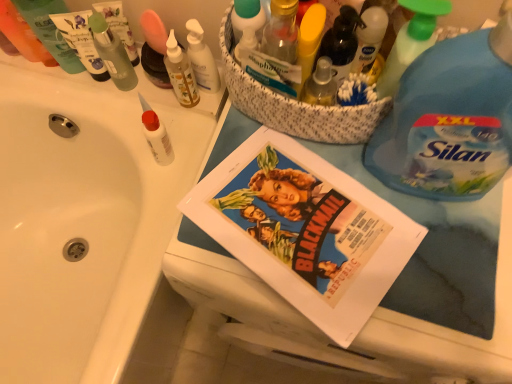
Image resolution: width=512 pixels, height=384 pixels. In order to click on vacant space in front of blue plastic bottle at right, the first cleaning product when ordered from right to left in this screenshot , I will do `click(440, 276)`.